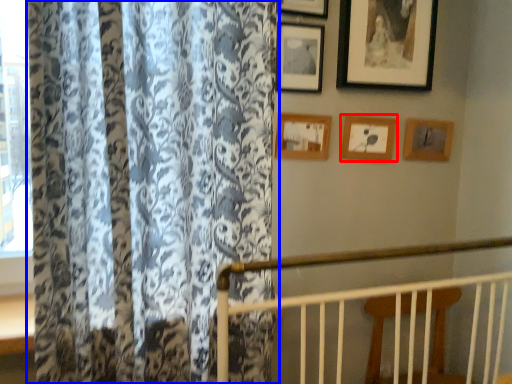
Question: Which object is closer to the camera taking this photo, picture frame (highlighted by a red box) or curtain (highlighted by a blue box)?

Choices:
 (A) picture frame
 (B) curtain

Answer: (B)